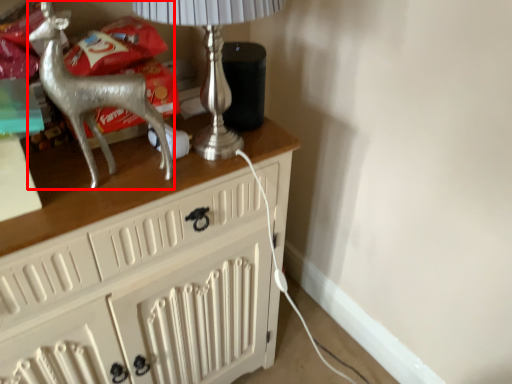
Question: From the image's perspective, where is reindeer (annotated by the red box) located in relation to table lamp in the image?

Choices:
 (A) below
 (B) above

Answer: (A)